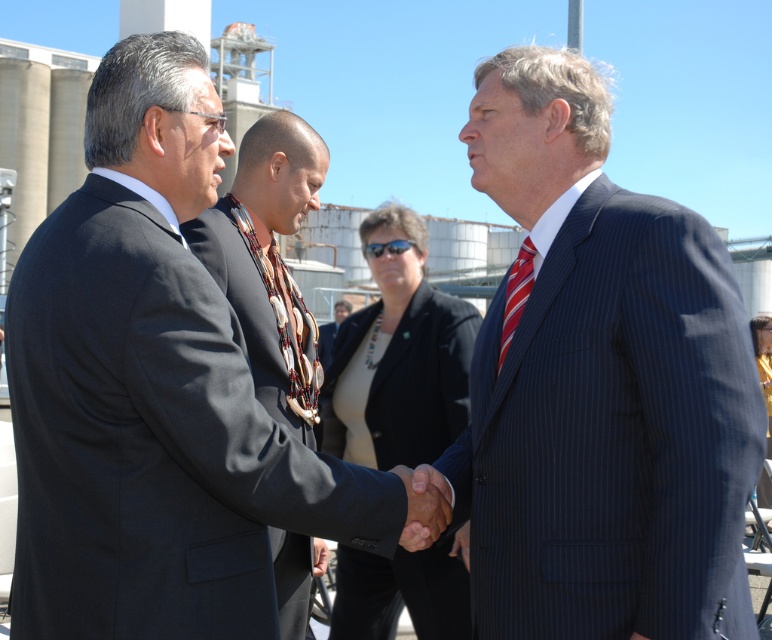
Question: Is pinstriped suit at center below matte black suit at center?

Choices:
 (A) no
 (B) yes

Answer: (A)

Question: Among these objects, which one is farthest from the camera?

Choices:
 (A) pinstriped suit at center
 (B) dark gray suit at center

Answer: (B)

Question: Does pinstriped suit at center appear on the right side of dark gray suit at center?

Choices:
 (A) no
 (B) yes

Answer: (B)

Question: Which point is closer to the camera taking this photo?

Choices:
 (A) (549, 465)
 (B) (342, 317)
 (C) (339, 568)

Answer: (A)

Question: Which object is positioned farthest from the pinstriped suit at center?

Choices:
 (A) dark blue suit at center
 (B) matte black suit at center

Answer: (A)

Question: From the image, what is the correct spatial relationship of pinstriped suit at center in relation to matte black blazer at center?

Choices:
 (A) above
 (B) below

Answer: (A)